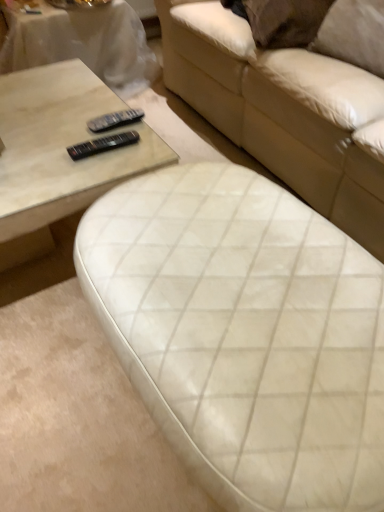
The height and width of the screenshot is (512, 384). What are the coordinates of `free point to the right of black plastic remote at center, the second remote positioned from the top` in the screenshot? It's located at point(137,157).